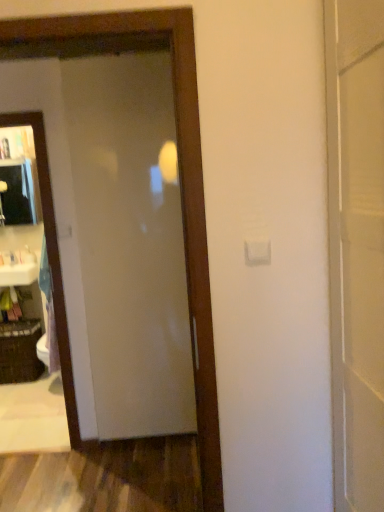
At what (x,y) coordinates should I click in order to perform the action: click on empty space that is ontop of matte glass door at center (from a real-world perspective). Please return your answer as a coordinate pair (x, y). Image resolution: width=384 pixels, height=512 pixels. Looking at the image, I should click on (112, 73).